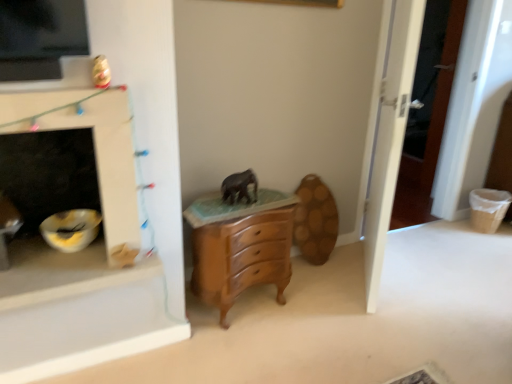
Identify the location of vacant area that is situated to the right of wooden chest of drawers at center. (323, 304).